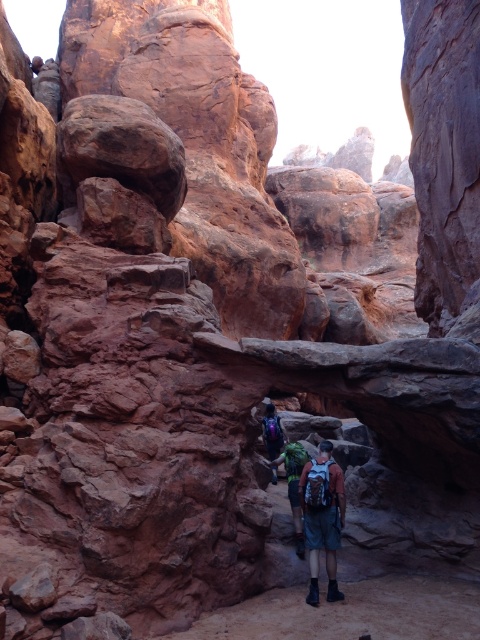
Which is in front, point (319, 522) or point (276, 420)?

Point (319, 522) is more forward.

Locate an element on the screen. The image size is (480, 640). matte blue shorts at center is located at coordinates (323, 516).

Which is behind, point (335, 548) or point (278, 422)?

Point (278, 422)

Locate an element on the screen. The height and width of the screenshot is (640, 480). matte blue shorts at center is located at coordinates (323, 516).

Is point (298, 545) farther from viewer compared to point (271, 458)?

That is False.

Who is shorter, blue backpack at center or matte purple backpack at center?

matte purple backpack at center

This screenshot has width=480, height=640. What do you see at coordinates (294, 484) in the screenshot?
I see `blue backpack at center` at bounding box center [294, 484].

At what (x,y) coordinates should I click in order to perform the action: click on blue backpack at center. Please return your answer as a coordinate pair (x, y). The image size is (480, 640). Looking at the image, I should click on (294, 484).

Between matte blue shorts at center and blue backpack at center, which one has more height?

blue backpack at center

Who is higher up, matte blue shorts at center or blue backpack at center?

blue backpack at center is higher up.

Measure the distance between point (314, 474) and camera.

Point (314, 474) and camera are 21.91 meters apart from each other.

What are the coordinates of `matte blue shorts at center` in the screenshot? It's located at (323, 516).